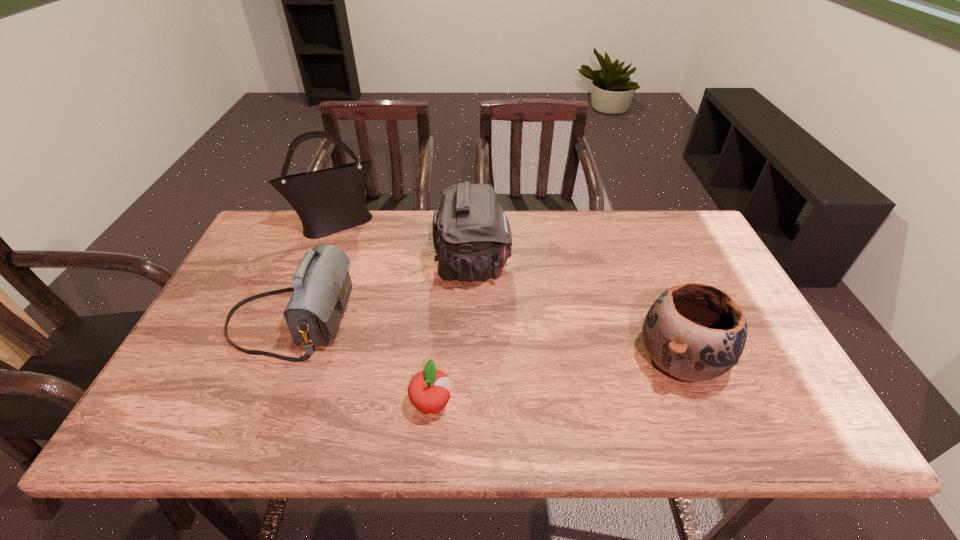
Locate an element on the screen. The height and width of the screenshot is (540, 960). vacant space located on the left of the rightmost object is located at coordinates (603, 360).

The height and width of the screenshot is (540, 960). Find the location of `vacant area situated 0.120m on the left of the shortest object`. vacant area situated 0.120m on the left of the shortest object is located at coordinates (357, 404).

Where is `object present at the near edge`? The width and height of the screenshot is (960, 540). object present at the near edge is located at coordinates (427, 390).

The height and width of the screenshot is (540, 960). What are the coordinates of `object that is at the right edge` in the screenshot? It's located at (x=692, y=332).

Image resolution: width=960 pixels, height=540 pixels. Identify the location of object located in the far left corner section of the desktop. pyautogui.click(x=328, y=201).

The width and height of the screenshot is (960, 540). Find the location of `blank space at the far edge of the desktop`. blank space at the far edge of the desktop is located at coordinates (367, 242).

You are a GUI agent. You are given a task and a screenshot of the screen. Output one action in this format:
    pyautogui.click(x=<x>, y=<y>)
    Task: Click on the vacant region at the near edge of the desktop
    
    Given the screenshot: What is the action you would take?
    pyautogui.click(x=682, y=407)

In the image, there is a desktop. Identify the location of vacant space at the left edge. This screenshot has width=960, height=540. (206, 364).

In the image, there is a desktop. Identify the location of vacant area at the right edge. The height and width of the screenshot is (540, 960). (775, 388).

Identify the location of blank space at the near right corner. The image size is (960, 540). tap(789, 409).